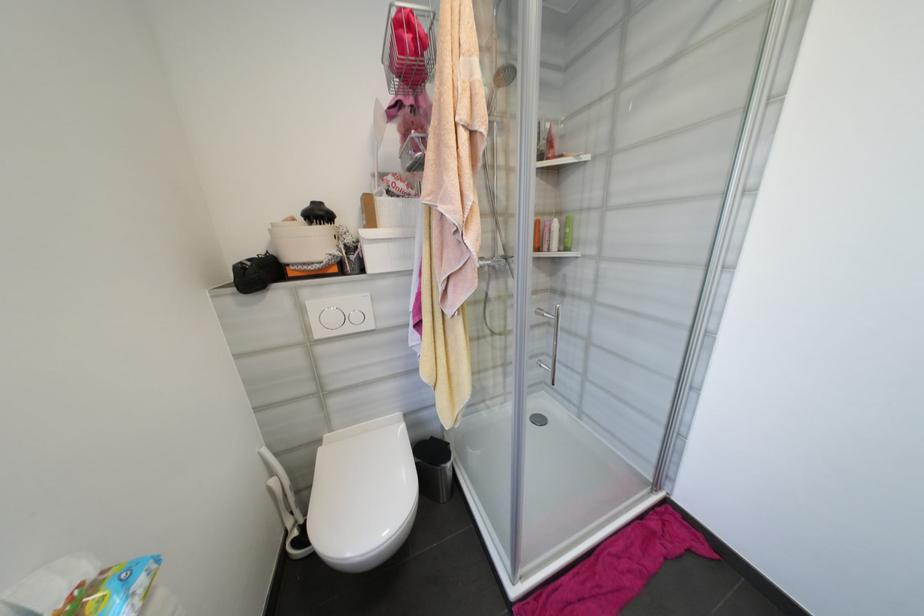
I want to click on white toilet lid, so click(362, 493).